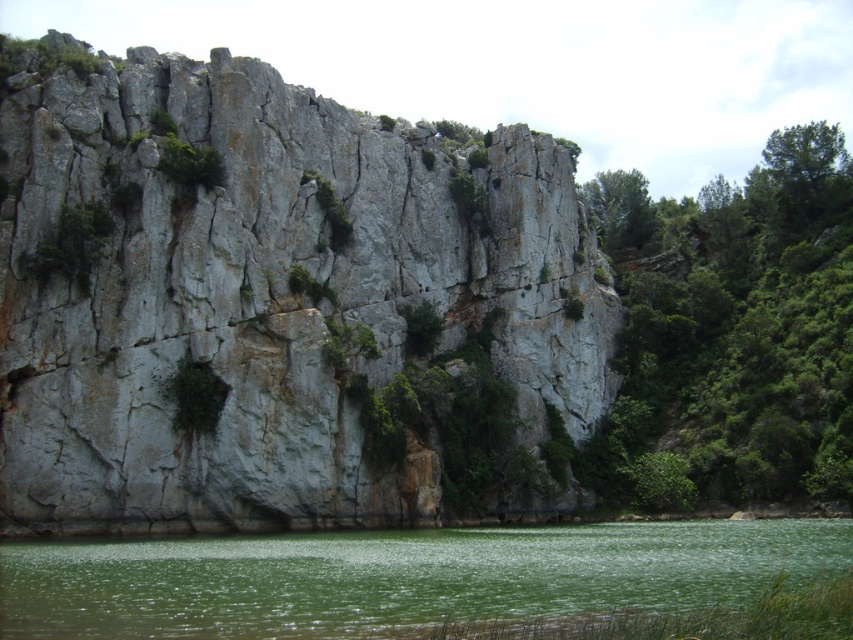
You are standing at the base of the large rock face and see two points marked on the rock surface. The first point is at coordinates point [614,301] and the second is at point [337,243]. Which point is closer to you?

Point [337,243] is closer to you because it is less further to the camera than point [614,301].

You are a hiker standing at the base of the large rock face. You need to cross the green smooth water at lower center to reach the green leafy tree at upper center. Can you estimate if the width of the water will allow you to cross it comfortably?

The green smooth water at lower center is wider than the green leafy tree at upper center. Since the water is wider, it may require a longer path to cross, but the exact distance needed isn